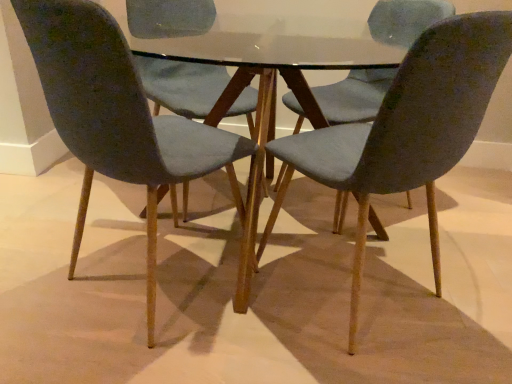
Locate an element on the screen. The height and width of the screenshot is (384, 512). free spot in front of matte gray chair at left, which appears as the 3th chair when viewed from the right is located at coordinates pos(132,355).